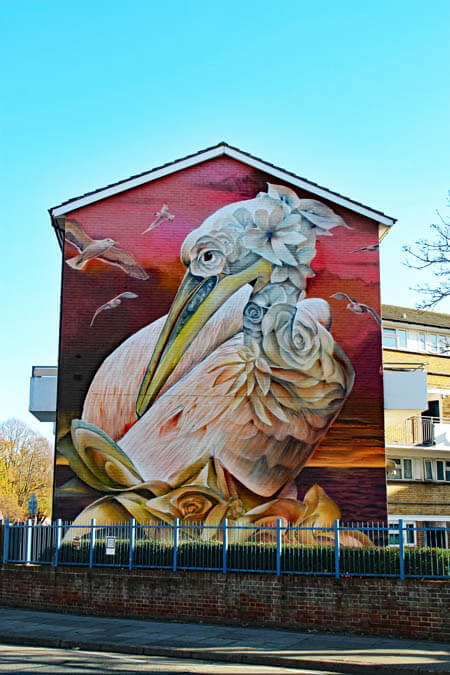
What are the coordinates of `brick wall` in the screenshot? It's located at (241, 590).